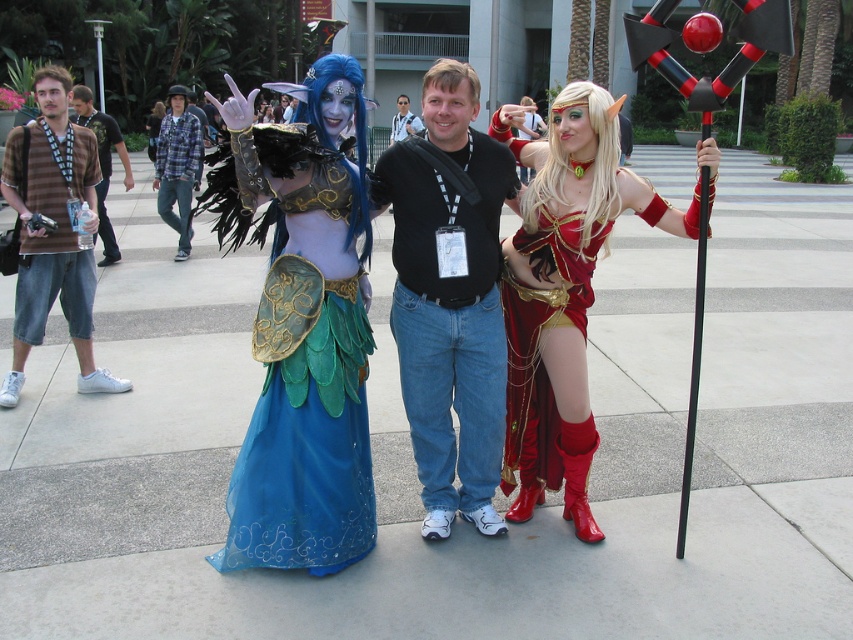
Question: Observing the image, what is the correct spatial positioning of matte blue fabric dress at left in reference to plaid flannel shirt at left?

Choices:
 (A) right
 (B) left

Answer: (A)

Question: Which point is farther to the camera?

Choices:
 (A) black cotton shirt at center
 (B) matte blue fabric dress at left
 (C) striped cotton shirt at left
 (D) matte black shirt at center

Answer: (C)

Question: Considering the real-world distances, which object is farthest from the brown striped shirt at left?

Choices:
 (A) black cotton t-shirt at center
 (B) shiny blue fabric dress at left
 (C) black cotton shirt at center
 (D) velvet red dress at center

Answer: (A)

Question: Estimate the real-world distances between objects in this image. Which object is closer to the matte black shirt at center?

Choices:
 (A) brown striped shirt at left
 (B) velvet red dress at center
 (C) black cotton shirt at center
 (D) plaid flannel shirt at left

Answer: (B)

Question: Is black cotton shirt at center positioned before striped cotton shirt at left?

Choices:
 (A) yes
 (B) no

Answer: (A)

Question: Does shiny blue fabric dress at left come in front of brown striped shirt at left?

Choices:
 (A) no
 (B) yes

Answer: (B)